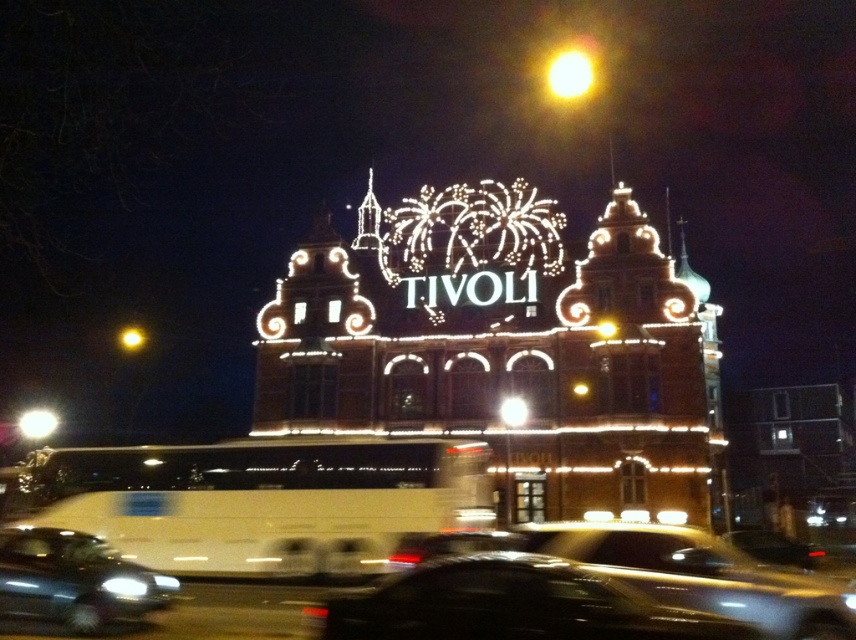
Question: Which of the following is the farthest from the observer?

Choices:
 (A) shiny black sedan at lower left
 (B) bright yellow light at upper center
 (C) metallic silver car at center
 (D) black glossy car at lower center

Answer: (B)

Question: Can you confirm if black glossy car at lower center is wider than metallic silver car at center?

Choices:
 (A) yes
 (B) no

Answer: (A)

Question: Which object is farther from the camera taking this photo?

Choices:
 (A) metallic silver car at center
 (B) bright yellow light at upper center
 (C) shiny black sedan at lower left

Answer: (B)

Question: Observing the image, what is the correct spatial positioning of shiny black sedan at lower left in reference to bright yellow light at upper center?

Choices:
 (A) right
 (B) left

Answer: (B)

Question: Does shiny black sedan at lower left appear on the left side of bright yellow light at upper center?

Choices:
 (A) yes
 (B) no

Answer: (A)

Question: Which of these objects is positioned farthest from the shiny black sedan at lower left?

Choices:
 (A) bright yellow light at upper center
 (B) black glossy car at lower center
 (C) metallic silver car at center

Answer: (A)